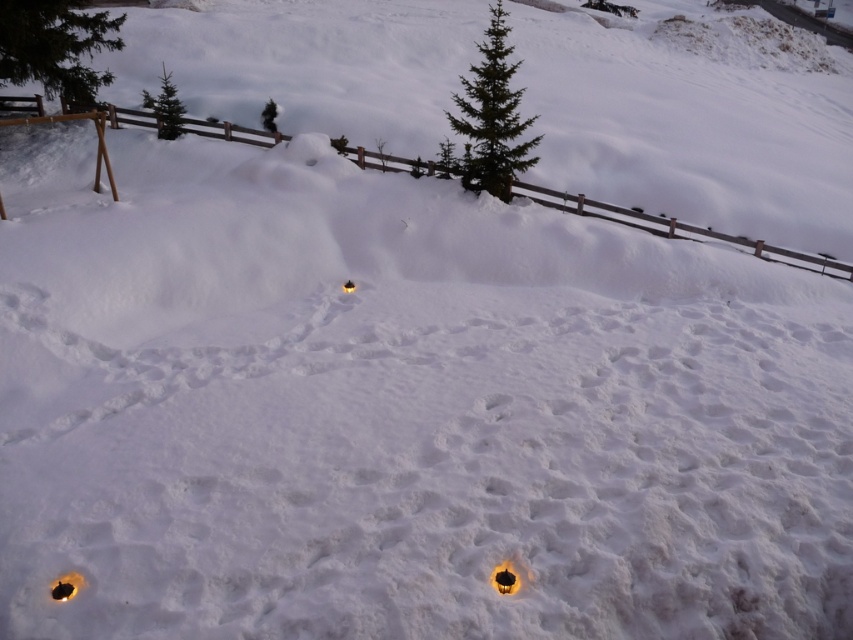
Can you confirm if brown wooden fence at upper center is taller than green matte tree at upper left?

Indeed, brown wooden fence at upper center has a greater height compared to green matte tree at upper left.

Does brown wooden fence at upper center appear on the left side of green matte tree at upper left?

No, brown wooden fence at upper center is not to the left of green matte tree at upper left.

Is point (824, 269) positioned in front of point (180, 129)?

Yes, it is.

Find the location of a particular element. The width and height of the screenshot is (853, 640). brown wooden fence at upper center is located at coordinates (676, 228).

Does green textured pine tree at upper left have a lesser width compared to green matte tree at upper center?

Indeed, green textured pine tree at upper left has a lesser width compared to green matte tree at upper center.

The width and height of the screenshot is (853, 640). What do you see at coordinates (55, 45) in the screenshot?
I see `green textured pine tree at upper left` at bounding box center [55, 45].

Measure the distance between green textured pine tree at upper left and camera.

The distance of green textured pine tree at upper left from camera is 18.00 meters.

What are the coordinates of `green textured pine tree at upper left` in the screenshot? It's located at (55, 45).

Does brown wooden fence at upper center have a larger size compared to green needle-like tree at upper center?

Incorrect, brown wooden fence at upper center is not larger than green needle-like tree at upper center.

Can you confirm if brown wooden fence at upper center is positioned to the right of green needle-like tree at upper center?

Incorrect, brown wooden fence at upper center is not on the right side of green needle-like tree at upper center.

Does point (224, 122) lie behind point (506, 104)?

Yes, point (224, 122) is behind point (506, 104).

This screenshot has height=640, width=853. I want to click on brown wooden fence at upper center, so click(676, 228).